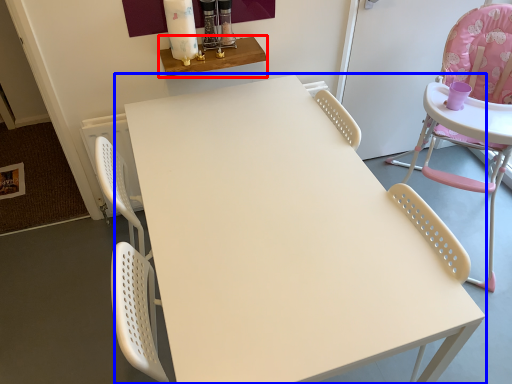
Question: Among these objects, which one is farthest to the camera, table (highlighted by a red box) or table (highlighted by a blue box)?

Choices:
 (A) table
 (B) table

Answer: (A)